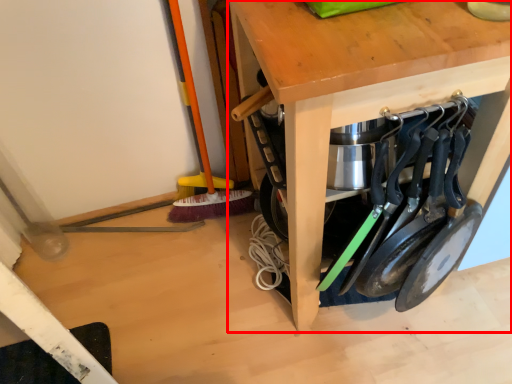
Question: From the image's perspective, what is the correct spatial positioning of table (annotated by the red box) in reference to tool?

Choices:
 (A) below
 (B) above

Answer: (B)